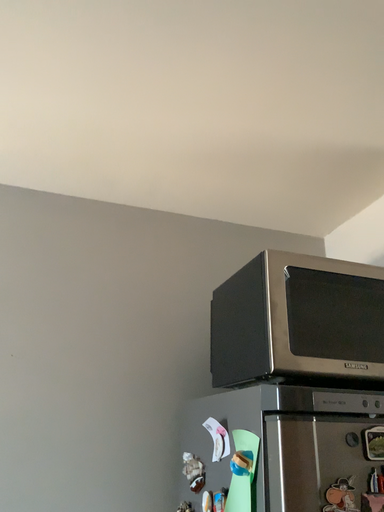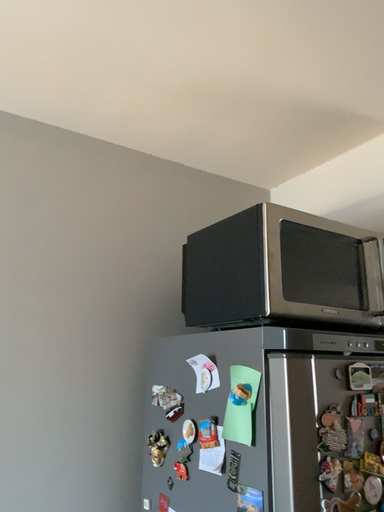
Question: How did the camera likely rotate when shooting the video?

Choices:
 (A) rotated right
 (B) rotated left

Answer: (A)